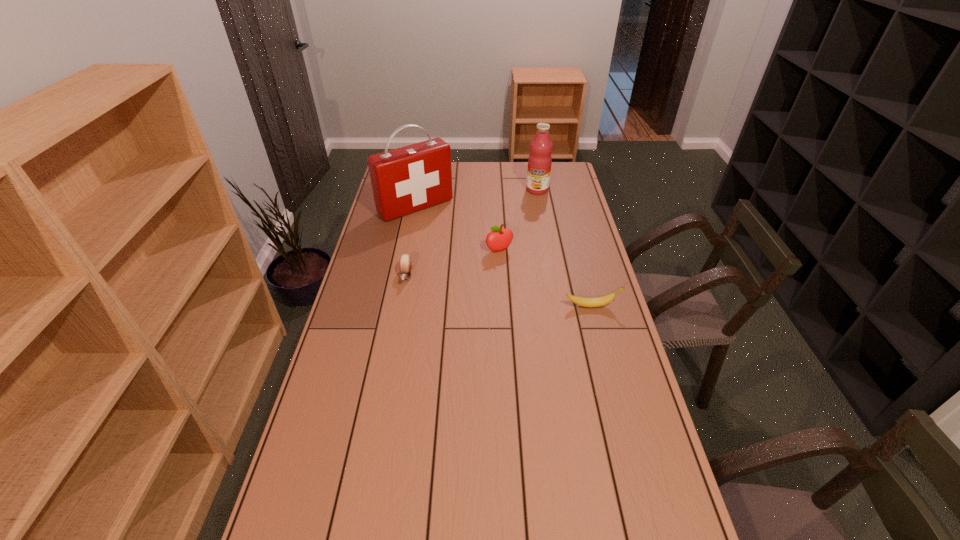
Locate an element on the screen. the shortest object is located at coordinates (405, 262).

I want to click on the second nearest object, so click(x=405, y=262).

In order to click on the nearest object in this screenshot , I will do `click(599, 301)`.

You are a GUI agent. You are given a task and a screenshot of the screen. Output one action in this format:
    pyautogui.click(x=<x>, y=<y>)
    Task: Click on the second shortest object
    
    Given the screenshot: What is the action you would take?
    pyautogui.click(x=599, y=301)

This screenshot has width=960, height=540. I want to click on fruit juice, so click(539, 162).

In order to click on the third object from left to right in this screenshot , I will do `click(499, 239)`.

In order to click on apple in this screenshot , I will do `click(499, 239)`.

At what (x,y) coordinates should I click in order to perform the action: click on the first-aid kit. Please return your answer as a coordinate pair (x, y). Looking at the image, I should click on (408, 179).

At what (x,y) coordinates should I click in order to perform the action: click on free region located 0.180m on the front-facing side of the escargot. Please return your answer as a coordinate pair (x, y). Looking at the image, I should click on (397, 325).

In order to click on free space located on the label of the fruit juice in this screenshot , I will do `click(516, 235)`.